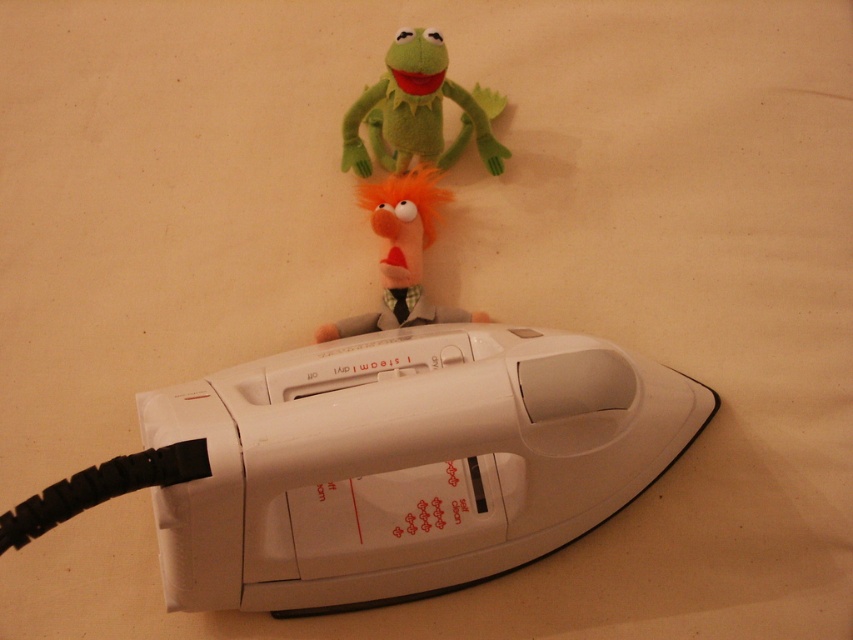
Is green plush frog at upper center further to camera compared to orange fuzzy puppet at center?

No, green plush frog at upper center is in front of orange fuzzy puppet at center.

Find the location of a particular element. The image size is (853, 640). green plush frog at upper center is located at coordinates (418, 112).

Is point (444, 92) farther from camera compared to point (469, 317)?

No, (444, 92) is in front of (469, 317).

Find the location of a particular element. This screenshot has width=853, height=640. green plush frog at upper center is located at coordinates (418, 112).